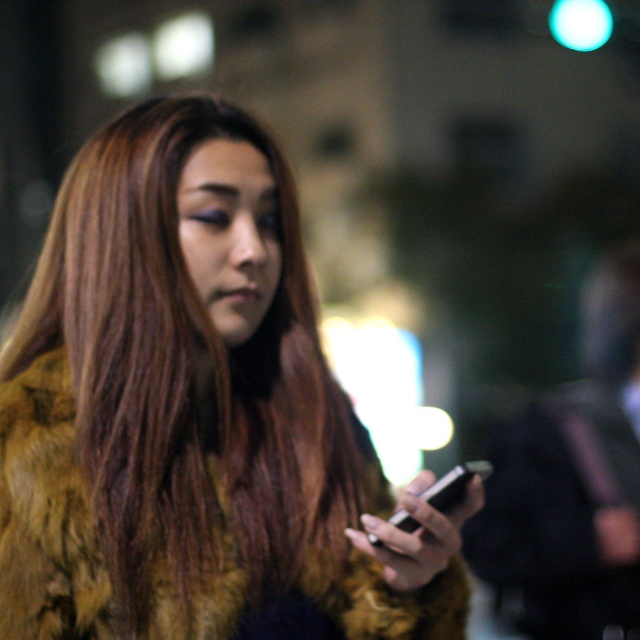
Question: Which of the following is the closest to the observer?

Choices:
 (A) (435, 492)
 (B) (246, 602)

Answer: (A)

Question: Does fur coat at center have a lesser width compared to black glossy smartphone at lower center?

Choices:
 (A) yes
 (B) no

Answer: (B)

Question: Can you confirm if fur coat at center is positioned above black glossy smartphone at lower center?

Choices:
 (A) no
 (B) yes

Answer: (B)

Question: Can you confirm if fur coat at center is positioned above black glossy smartphone at lower center?

Choices:
 (A) no
 (B) yes

Answer: (B)